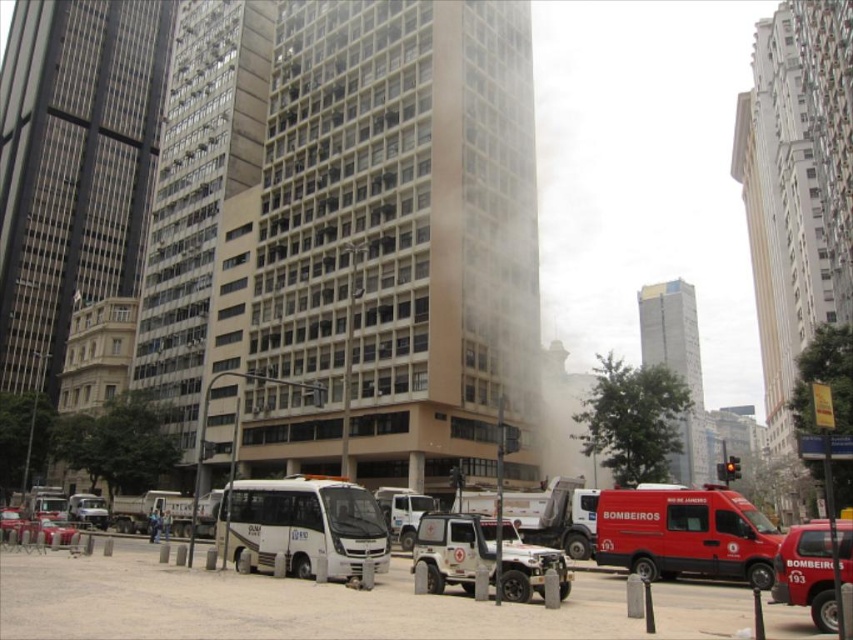
Question: Can you confirm if matte red van at lower right is positioned to the left of white matte van at center?

Choices:
 (A) no
 (B) yes

Answer: (A)

Question: Estimate the real-world distances between objects in this image. Which object is closer to the matte red van at lower right?

Choices:
 (A) metallic silver car at lower left
 (B) white matte van at center
 (C) white matte emergency vehicle at center

Answer: (C)

Question: Among these points, which one is farthest from the camera?

Choices:
 (A) (305, 499)
 (B) (50, 524)
 (C) (602, 513)
 (D) (466, 588)

Answer: (B)

Question: Which object is the farthest from the white matte emergency vehicle at center?

Choices:
 (A) metallic silver car at lower left
 (B) white matte van at center
 (C) matte red van at lower right

Answer: (A)

Question: Can you confirm if matte red van at lower right is thinner than white matte van at center?

Choices:
 (A) yes
 (B) no

Answer: (A)

Question: Can you confirm if matte red van at lower right is thinner than white matte van at center?

Choices:
 (A) yes
 (B) no

Answer: (A)